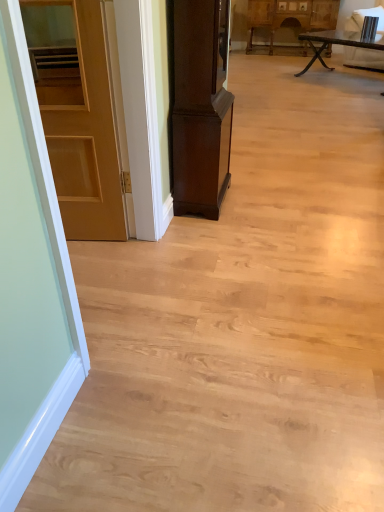
Identify the location of dark wood cabinet at center, the 2th cabinetry when ordered from right to left. (200, 106).

This screenshot has width=384, height=512. What do you see at coordinates (77, 114) in the screenshot?
I see `matte wooden door at left` at bounding box center [77, 114].

Where is `wooden rustic table at upper right`? wooden rustic table at upper right is located at coordinates (333, 42).

You are a GUI agent. You are given a task and a screenshot of the screen. Output one action in this format:
    pyautogui.click(x=<x>, y=<y>)
    Task: Click on the wooden carved cabinet at upper center, the 2th cabinetry in the bottom-to-top sequence
    The image size is (384, 512).
    Given the screenshot: What is the action you would take?
    pyautogui.click(x=290, y=17)

From the image's perspective, is matte wooden door at left above or below dark wood cabinet at center, acting as the 1th cabinetry starting from the bottom?

matte wooden door at left is below dark wood cabinet at center, acting as the 1th cabinetry starting from the bottom.

Could dark wood cabinet at center, acting as the 2th cabinetry starting from the top, be considered to be inside matte wooden door at left?

No, dark wood cabinet at center, acting as the 2th cabinetry starting from the top, is located outside of matte wooden door at left.

How different are the orientations of matte wooden door at left and dark wood cabinet at center, the second cabinetry positioned from the back, in degrees?

82.7 degrees separate the facing orientations of matte wooden door at left and dark wood cabinet at center, the second cabinetry positioned from the back.

Is dark wood cabinet at center, acting as the 1th cabinetry starting from the bottom, aimed at wooden carved cabinet at upper center, which appears as the 2th cabinetry when viewed from the left?

No.

Find the location of a particular element. cabinetry lying on the right of dark wood cabinet at center, arranged as the first cabinetry when viewed from the front is located at coordinates (290, 17).

Does dark wood cabinet at center, the second cabinetry positioned from the back, appear on the left side of wooden carved cabinet at upper center, which is the second cabinetry from front to back?

Yes, dark wood cabinet at center, the second cabinetry positioned from the back, is to the left of wooden carved cabinet at upper center, which is the second cabinetry from front to back.

Do you think dark wood cabinet at center, acting as the 2th cabinetry starting from the top, is within wooden carved cabinet at upper center, the 2th cabinetry in the bottom-to-top sequence, or outside of it?

dark wood cabinet at center, acting as the 2th cabinetry starting from the top, is spatially situated outside wooden carved cabinet at upper center, the 2th cabinetry in the bottom-to-top sequence.

Is matte wooden door at left completely or partially outside of wooden rustic table at upper right?

Yes, matte wooden door at left is located beyond the bounds of wooden rustic table at upper right.

Visually, is matte wooden door at left positioned to the left or to the right of wooden rustic table at upper right?

matte wooden door at left is positioned on wooden rustic table at upper right's left side.

Relative to wooden rustic table at upper right, is matte wooden door at left in front or behind?

matte wooden door at left is positioned closer to the viewer than wooden rustic table at upper right.

Is matte wooden door at left facing towards wooden rustic table at upper right?

No, matte wooden door at left is not turned towards wooden rustic table at upper right.

From a real-world perspective, is wooden carved cabinet at upper center, acting as the first cabinetry starting from the back, physically above dark wood cabinet at center, acting as the 1th cabinetry starting from the bottom?

No, from a real-world perspective, wooden carved cabinet at upper center, acting as the first cabinetry starting from the back, is not above dark wood cabinet at center, acting as the 1th cabinetry starting from the bottom.

Could you tell me if wooden carved cabinet at upper center, the 2th cabinetry in the bottom-to-top sequence, is turned towards dark wood cabinet at center, the 2th cabinetry when ordered from right to left?

Yes.

Between wooden carved cabinet at upper center, the 2th cabinetry in the bottom-to-top sequence, and dark wood cabinet at center, the 2th cabinetry when ordered from right to left, which one is positioned behind?

wooden carved cabinet at upper center, the 2th cabinetry in the bottom-to-top sequence, is further away from the camera.

Looking at this image, considering the relative positions of wooden carved cabinet at upper center, the 1th cabinetry positioned from the right, and wooden rustic table at upper right in the image provided, is wooden carved cabinet at upper center, the 1th cabinetry positioned from the right, to the left of wooden rustic table at upper right from the viewer's perspective?

Yes, wooden carved cabinet at upper center, the 1th cabinetry positioned from the right, is to the left of wooden rustic table at upper right.

Identify the location of cabinetry behind the wooden rustic table at upper right. This screenshot has width=384, height=512. (290, 17).

Is wooden carved cabinet at upper center, the 2th cabinetry in the bottom-to-top sequence, not within wooden rustic table at upper right?

Yes, wooden carved cabinet at upper center, the 2th cabinetry in the bottom-to-top sequence, is located beyond the bounds of wooden rustic table at upper right.

Could you measure the distance between wooden carved cabinet at upper center, acting as the first cabinetry starting from the back, and wooden rustic table at upper right?

A distance of 83.35 centimeters exists between wooden carved cabinet at upper center, acting as the first cabinetry starting from the back, and wooden rustic table at upper right.

Considering the relative sizes of wooden rustic table at upper right and matte wooden door at left in the image provided, is wooden rustic table at upper right smaller than matte wooden door at left?

No.

Considering the sizes of wooden rustic table at upper right and matte wooden door at left in the image, is wooden rustic table at upper right taller or shorter than matte wooden door at left?

In the image, wooden rustic table at upper right appears to be shorter than matte wooden door at left.

From a real-world perspective, between wooden rustic table at upper right and matte wooden door at left, who is vertically higher?

matte wooden door at left.

Is wooden rustic table at upper right wider than matte wooden door at left?

Indeed, wooden rustic table at upper right has a greater width compared to matte wooden door at left.

Is wooden carved cabinet at upper center, the 2th cabinetry in the bottom-to-top sequence, behind matte wooden door at left?

Yes, it is.

Can you confirm if wooden carved cabinet at upper center, the 1th cabinetry positioned from the right, is shorter than matte wooden door at left?

Correct, wooden carved cabinet at upper center, the 1th cabinetry positioned from the right, is not as tall as matte wooden door at left.

Which is in front, point (319, 5) or point (82, 233)?

The point (82, 233) is closer to the camera.

Based on the photo, is wooden carved cabinet at upper center, acting as the first cabinetry starting from the back, inside or outside of matte wooden door at left?

wooden carved cabinet at upper center, acting as the first cabinetry starting from the back, lies outside matte wooden door at left.

Locate an element on the screen. door above the dark wood cabinet at center, acting as the 2th cabinetry starting from the top (from a real-world perspective) is located at coordinates 77,114.

The height and width of the screenshot is (512, 384). I want to click on cabinetry on the right of dark wood cabinet at center, the second cabinetry positioned from the back, so click(290, 17).

In the scene shown: When comparing their distances from dark wood cabinet at center, arranged as the first cabinetry when viewed from the front, does matte wooden door at left or wooden carved cabinet at upper center, the 1th cabinetry positioned from the right, seem closer?

matte wooden door at left is closer to dark wood cabinet at center, arranged as the first cabinetry when viewed from the front.

Looking at the image, which one is located further to wooden rustic table at upper right, wooden carved cabinet at upper center, which appears as the 2th cabinetry when viewed from the left, or matte wooden door at left?

matte wooden door at left is further to wooden rustic table at upper right.

Looking at the image, which one is located further to dark wood cabinet at center, acting as the 2th cabinetry starting from the top, wooden rustic table at upper right or matte wooden door at left?

The object further to dark wood cabinet at center, acting as the 2th cabinetry starting from the top, is wooden rustic table at upper right.

From the image, which object appears to be nearer to matte wooden door at left, wooden rustic table at upper right or wooden carved cabinet at upper center, which appears as the 2th cabinetry when viewed from the left?

wooden rustic table at upper right is closer to matte wooden door at left.

Which object lies further to the anchor point wooden carved cabinet at upper center, acting as the first cabinetry starting from the back, matte wooden door at left or wooden rustic table at upper right?

matte wooden door at left is further to wooden carved cabinet at upper center, acting as the first cabinetry starting from the back.

From the image, which object appears to be nearer to wooden carved cabinet at upper center, the 2th cabinetry in the bottom-to-top sequence, matte wooden door at left or dark wood cabinet at center, the second cabinetry positioned from the back?

Based on the image, dark wood cabinet at center, the second cabinetry positioned from the back, appears to be nearer to wooden carved cabinet at upper center, the 2th cabinetry in the bottom-to-top sequence.

From the image, which object appears to be farther from wooden carved cabinet at upper center, the 1th cabinetry when ordered from top to bottom, wooden rustic table at upper right or dark wood cabinet at center, acting as the 1th cabinetry starting from the bottom?

dark wood cabinet at center, acting as the 1th cabinetry starting from the bottom, lies further to wooden carved cabinet at upper center, the 1th cabinetry when ordered from top to bottom, than the other object.

Based on their spatial positions, is dark wood cabinet at center, acting as the 2th cabinetry starting from the top, or matte wooden door at left further from wooden carved cabinet at upper center, the 1th cabinetry when ordered from top to bottom?

The object further to wooden carved cabinet at upper center, the 1th cabinetry when ordered from top to bottom, is matte wooden door at left.

Find the location of a particular element. table positioned between matte wooden door at left and wooden carved cabinet at upper center, acting as the first cabinetry starting from the back, from near to far is located at coordinates (333, 42).

Find the location of a particular element. This screenshot has height=512, width=384. cabinetry positioned between matte wooden door at left and wooden rustic table at upper right from near to far is located at coordinates (200, 106).

In order to click on cabinetry between matte wooden door at left and wooden carved cabinet at upper center, which appears as the 2th cabinetry when viewed from the left, along the z-axis in this screenshot , I will do 200,106.

In order to click on table between dark wood cabinet at center, arranged as the first cabinetry when viewed from the front, and wooden carved cabinet at upper center, the 1th cabinetry positioned from the right, along the z-axis in this screenshot , I will do `click(333, 42)`.